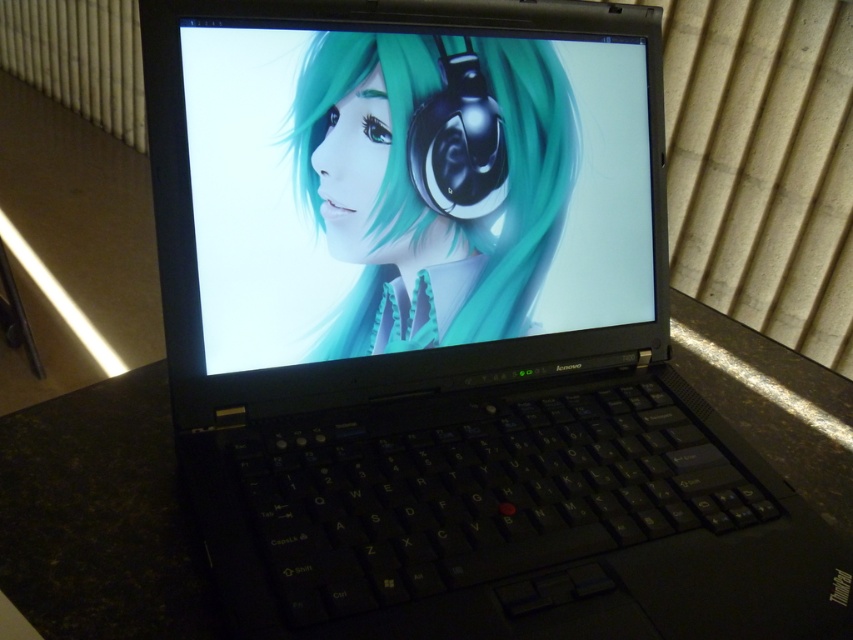
Between black matte table at center and black glossy earphone at center, which one appears on the right side from the viewer's perspective?

Positioned to the right is black matte table at center.

Does black matte table at center appear under black glossy earphone at center?

Correct, black matte table at center is located below black glossy earphone at center.

Between point (223, 627) and point (486, 113), which one is positioned in front?

Point (223, 627) is in front.

Locate an element on the screen. This screenshot has width=853, height=640. black matte table at center is located at coordinates (100, 516).

Can you confirm if matte black screen at center is shorter than black glossy earphone at center?

No.

Looking at this image, who is lower down, matte black screen at center or black glossy earphone at center?

Positioned lower is matte black screen at center.

This screenshot has width=853, height=640. Identify the location of matte black screen at center. (412, 188).

You are a GUI agent. You are given a task and a screenshot of the screen. Output one action in this format:
    pyautogui.click(x=<x>, y=<y>)
    Task: Click on the matte black screen at center
    The height and width of the screenshot is (640, 853).
    Given the screenshot: What is the action you would take?
    [412, 188]

Is point (329, 113) more distant than point (51, 540)?

Yes, it is.

Can you confirm if matte black screen at center is positioned to the left of black matte table at center?

Yes, matte black screen at center is to the left of black matte table at center.

You are a GUI agent. You are given a task and a screenshot of the screen. Output one action in this format:
    pyautogui.click(x=<x>, y=<y>)
    Task: Click on the matte black screen at center
    The image size is (853, 640).
    Given the screenshot: What is the action you would take?
    pyautogui.click(x=412, y=188)